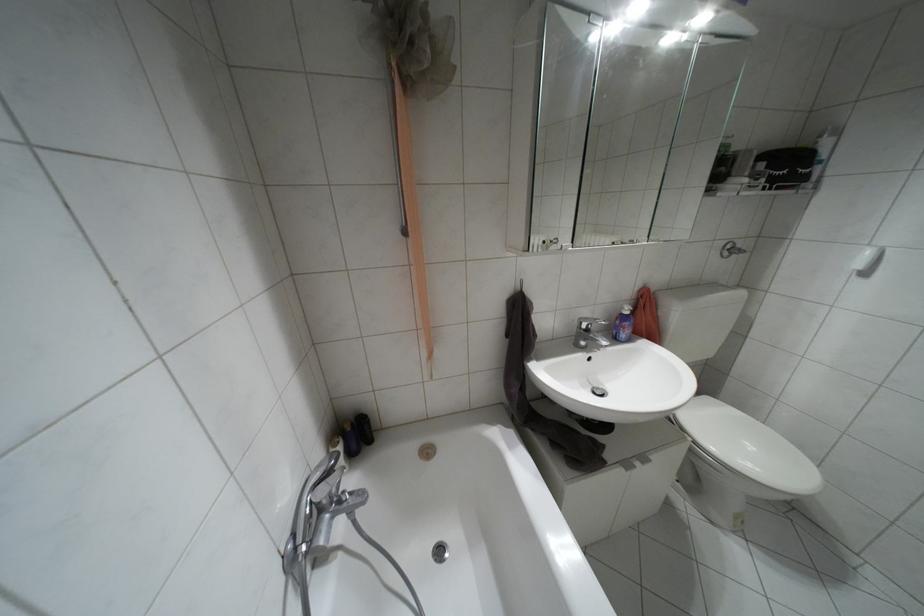
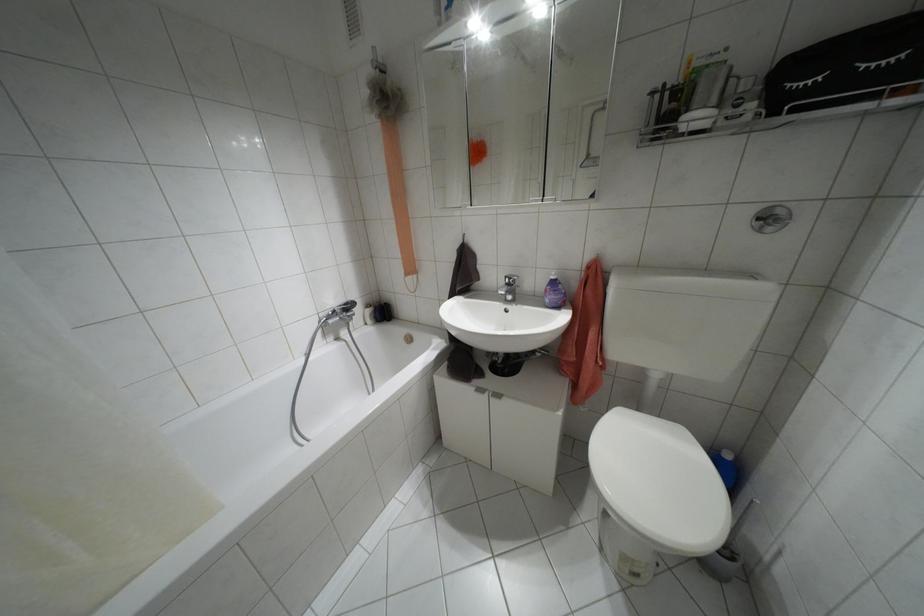
Locate, in the second image, the point that corresponds to (626,312) in the first image.

(552, 277)